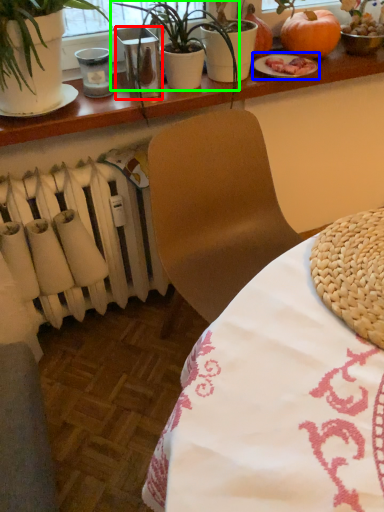
Question: Which object is the closest to the glass vase (highlighted by a red box)? Choose among these: tableware (highlighted by a blue box) or houseplant (highlighted by a green box).

Choices:
 (A) tableware
 (B) houseplant

Answer: (B)